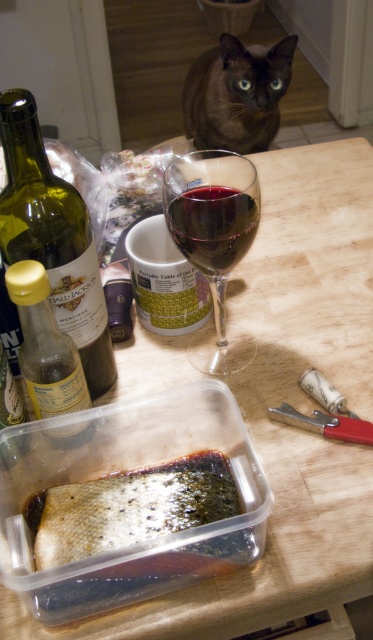
You are a guest at a dinner party and want to pour wine from the green glass bottle at left into the transparent glass wine glass at center. Can you reach the bottle without moving the glass?

The green glass bottle at left is closer to the viewer than the transparent glass wine glass at center, so you can easily reach the bottle without moving the glass.

From the picture: What is the object located at the coordinates point [52,237]?

The object located at point [52,237] is the green glass bottle at left.